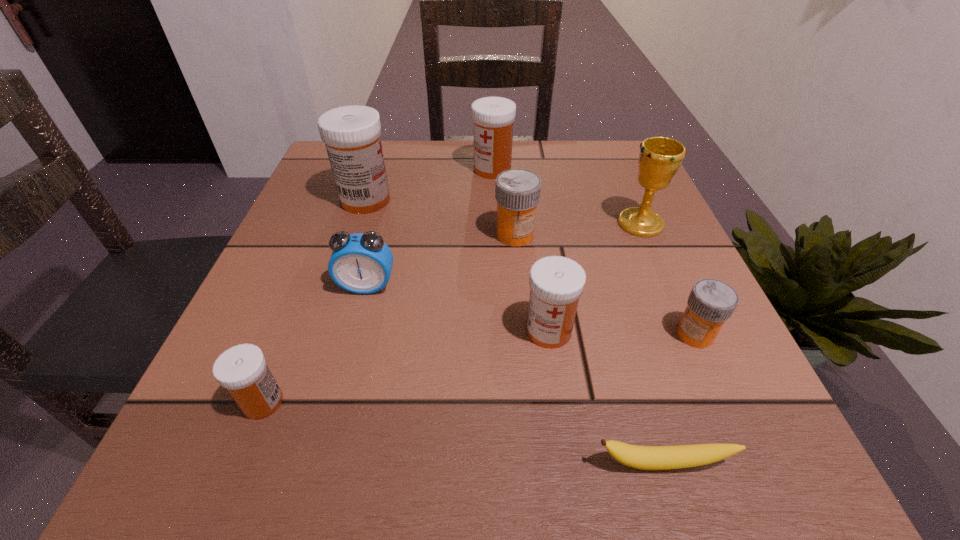
Image resolution: width=960 pixels, height=540 pixels. Identify the location of the fifth nearest medicine. (351, 133).

Identify the location of the third nearest white medicine. This screenshot has height=540, width=960. (351, 133).

Find the location of a particular element. gold chalice is located at coordinates (660, 158).

The image size is (960, 540). I want to click on the second biggest white medicine, so click(493, 117).

This screenshot has width=960, height=540. In order to click on the farthest white medicine in this screenshot , I will do `click(493, 117)`.

The height and width of the screenshot is (540, 960). Find the location of `the third farthest medicine`. the third farthest medicine is located at coordinates (517, 191).

The width and height of the screenshot is (960, 540). Find the location of `the bigger orange medicine`. the bigger orange medicine is located at coordinates (517, 191).

At what (x,y) coordinates should I click in order to perform the action: click on the third biggest white medicine. Please return your answer as a coordinate pair (x, y). Looking at the image, I should click on (556, 282).

Find the location of a particular element. This screenshot has height=540, width=960. the fifth nearest object is located at coordinates (360, 263).

You are a GUI agent. You are given a task and a screenshot of the screen. Output one action in this format:
    pyautogui.click(x=<x>, y=<y>)
    Task: Click on the rightmost medicine
    Image resolution: width=960 pixels, height=540 pixels.
    Given the screenshot: What is the action you would take?
    pyautogui.click(x=711, y=302)